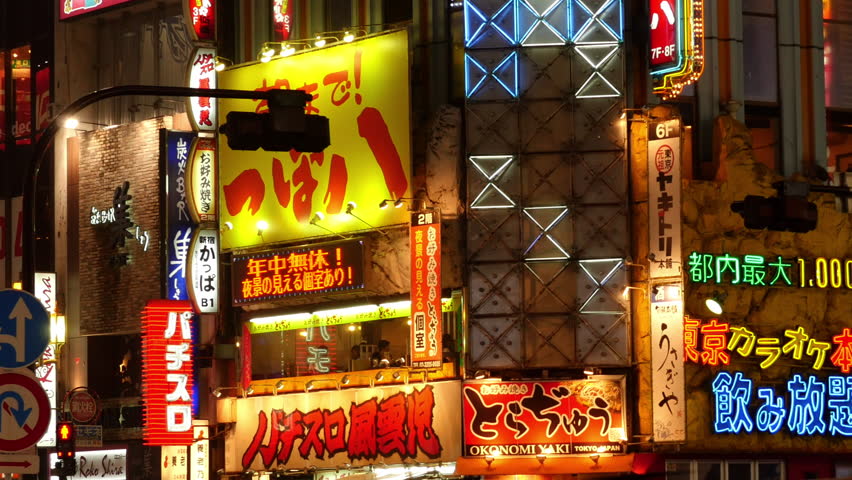
At what (x,y) coordinates should I click in order to perform the action: click on brick wall. Please return your answer as a coordinate pair (x, y). The image size is (852, 480). Looking at the image, I should click on (135, 176).